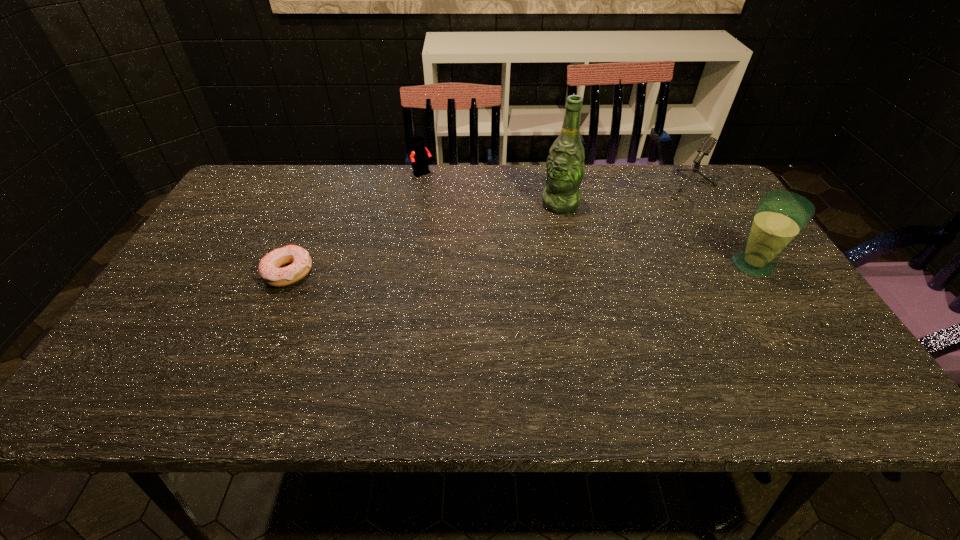
Select which object appears as the second closest to the third object from right to left. Please provide its 2D coordinates. Your answer should be formatted as a tuple, i.e. [(x, y)], where the tuple contains the x and y coordinates of a point satisfying the conditions above.

[(420, 155)]

Identify the location of vacant space that satisfies the following two spatial constraints: 1. on the front side of the microphone; 2. on the left side of the fourth object from right to left. This screenshot has height=540, width=960. (421, 191).

You are a GUI agent. You are given a task and a screenshot of the screen. Output one action in this format:
    pyautogui.click(x=<x>, y=<y>)
    Task: Click on the free spot that satisfies the following two spatial constraints: 1. on the front side of the second object from left to right; 2. on the left side of the tallest object
    The height and width of the screenshot is (540, 960).
    Given the screenshot: What is the action you would take?
    [420, 204]

Find the location of `free space that satisfies the following two spatial constraints: 1. on the front side of the second tallest object; 2. on the left side of the microphone`. free space that satisfies the following two spatial constraints: 1. on the front side of the second tallest object; 2. on the left side of the microphone is located at coordinates (722, 265).